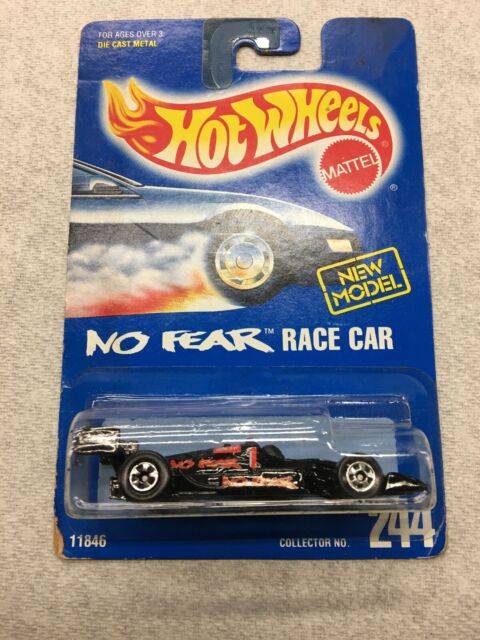
I want to click on fabric, so click(25, 304), click(470, 392), click(142, 605).